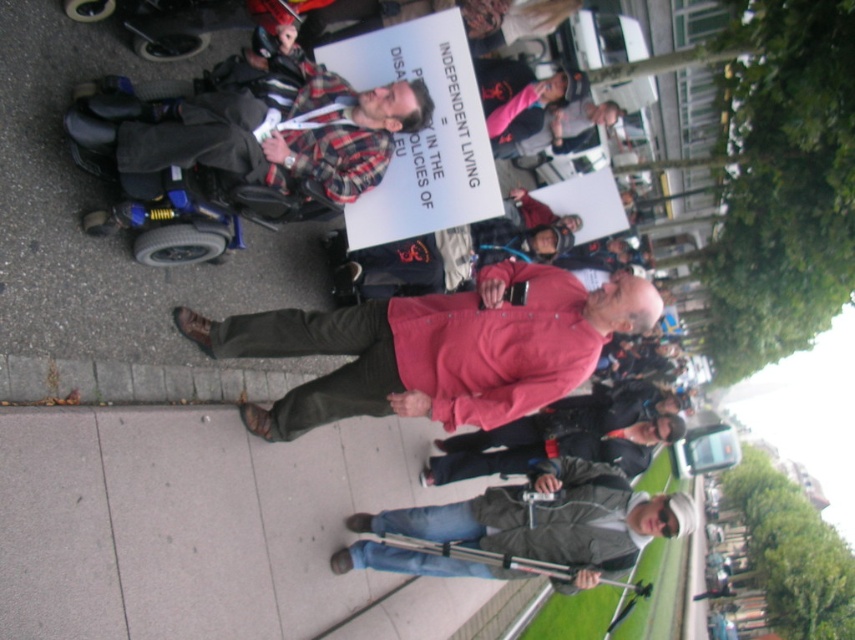
You are standing at the center of the image and want to walk to the gray concrete sidewalk at lower left. In which direction should you move?

You should move towards the lower left direction to reach the gray concrete sidewalk at lower left.

You are a photographer trying to capture a clear photo of the plaid fabric shirt at center. The red cotton shirt at center is blocking your view. Can you step to the side to get a better angle?

The red cotton shirt at center is further to the viewer than plaid fabric shirt at center, so stepping to the side might allow you to see around the red cotton shirt at center to capture the plaid fabric shirt at center.